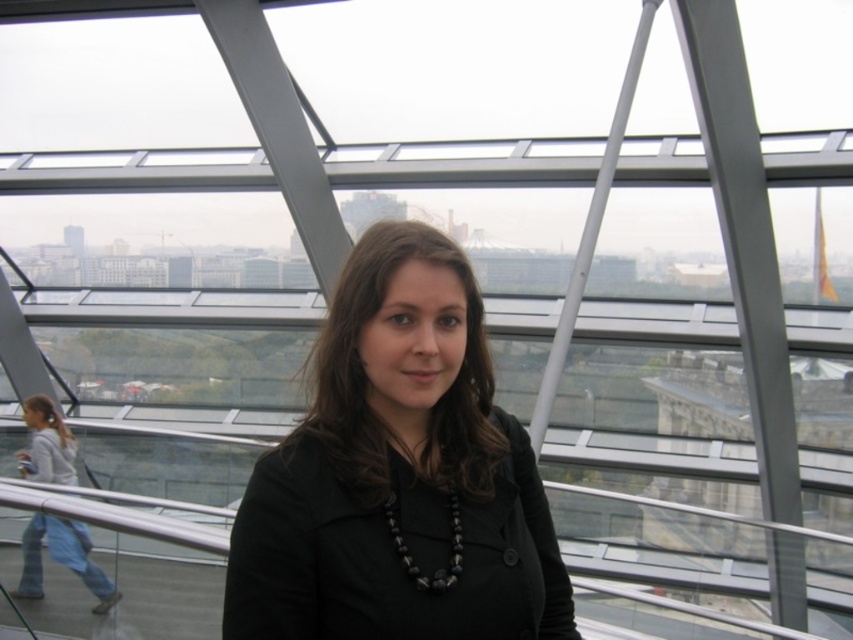
Based on the coordinates provided, where is the black matte jacket at center located in the image?

The black matte jacket at center is located at the coordinates point [398,474].

From the picture: You are a fashion designer observing a model wearing a black matte jacket at center and light blue jeans at lower left. Which piece of clothing is closer to the camera?

The black matte jacket at center is closer to the camera because it is in front of the light blue jeans at lower left.

You are a fashion designer observing the person in the image. You need to determine if their black matte jacket at center can fit into a storage box designed for items narrower than the light blue jeans at lower left. Can the jacket fit?

The black matte jacket at center has a larger width than the light blue jeans at lower left, so it cannot fit into a storage box designed for items narrower than the light blue jeans at lower left.